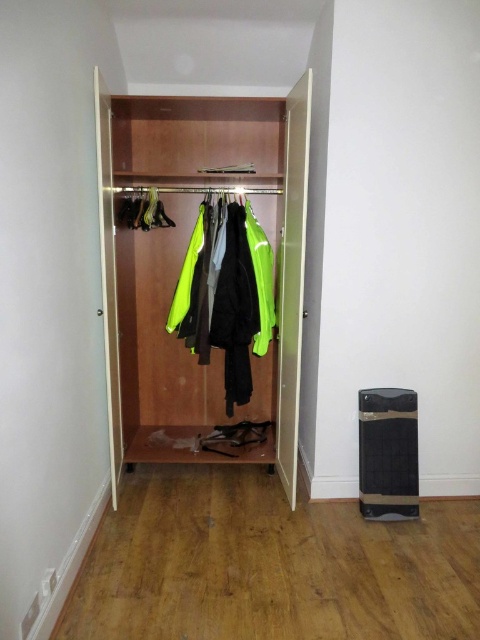
Can you confirm if wooden coat rack at center is bigger than neon yellow fabric at center?

Indeed, wooden coat rack at center has a larger size compared to neon yellow fabric at center.

Is point (215, 317) in front of point (243, 216)?

Yes, point (215, 317) is in front of point (243, 216).

Locate an element on the screen. wooden coat rack at center is located at coordinates (204, 275).